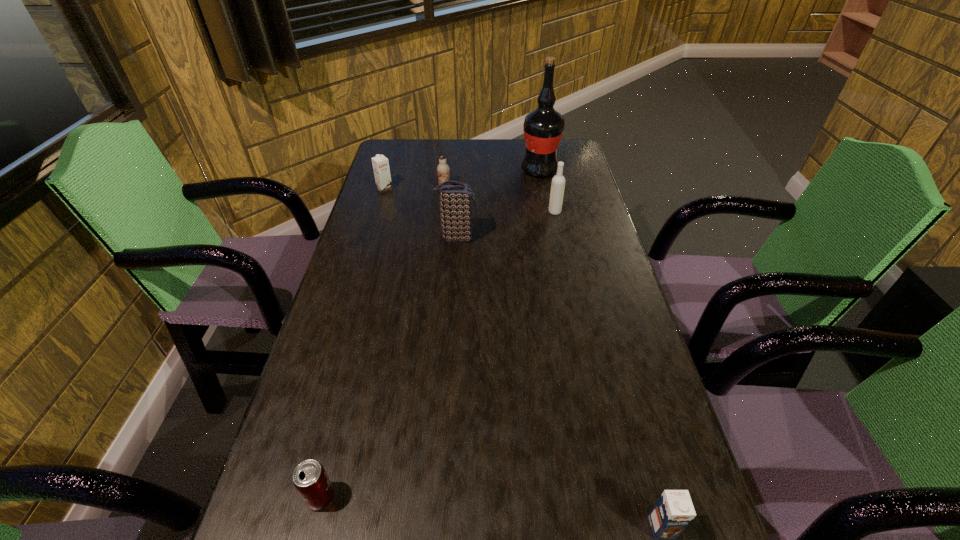
Where is `chocolate milk present at the right edge`? This screenshot has width=960, height=540. chocolate milk present at the right edge is located at coordinates (674, 510).

Where is `object that is positioned at the far right corner`? object that is positioned at the far right corner is located at coordinates (543, 127).

Where is `vacant space at the far edge of the desktop`? vacant space at the far edge of the desktop is located at coordinates (436, 161).

Locate an element on the screen. vacant area at the left edge of the desktop is located at coordinates (362, 276).

In order to click on free point at the right edge in this screenshot , I will do `click(607, 510)`.

In the image, there is a desktop. Where is `vacant space at the far left corner`? vacant space at the far left corner is located at coordinates (406, 154).

The image size is (960, 540). I want to click on unoccupied position between the fifth farthest object and the tallest object, so click(x=498, y=204).

Where is `free space between the leftmost chocolate milk and the second chocolate milk from right to left`? free space between the leftmost chocolate milk and the second chocolate milk from right to left is located at coordinates (415, 188).

Find the location of a particular element. The height and width of the screenshot is (540, 960). vacant area between the clutch bag and the rightmost object is located at coordinates (559, 382).

Identify the location of free point between the vodka and the wine bottle. The image size is (960, 540). point(547,191).